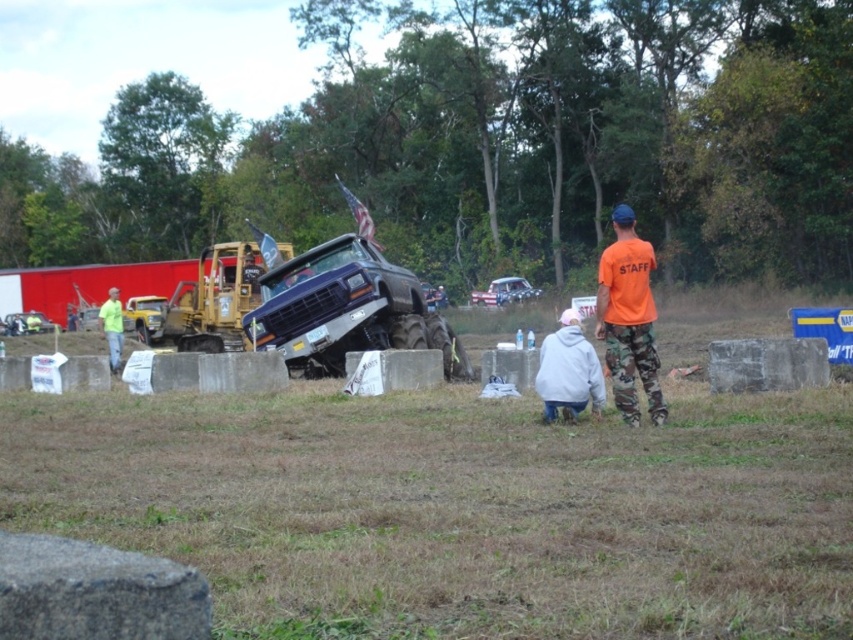
Question: Which object appears closest to the camera in this image?

Choices:
 (A) metallic silver car at center
 (B) neon yellow jacket at left

Answer: (B)

Question: Does orange t-shirt at right appear over gray fleece jacket at center?

Choices:
 (A) yes
 (B) no

Answer: (A)

Question: Estimate the real-world distances between objects in this image. Which object is closer to the orange t-shirt at right?

Choices:
 (A) metallic purple truck at center
 (B) gray fleece jacket at center

Answer: (B)

Question: Estimate the real-world distances between objects in this image. Which object is closer to the brushed metal car at left?

Choices:
 (A) metallic purple truck at center
 (B) neon yellow jacket at left
 (C) gray fleece jacket at center
 (D) orange t-shirt at right

Answer: (B)

Question: Does metallic purple truck at center have a larger size compared to neon yellow jacket at left?

Choices:
 (A) yes
 (B) no

Answer: (A)

Question: Considering the relative positions of gray fleece jacket at center and brushed metal car at left in the image provided, where is gray fleece jacket at center located with respect to brushed metal car at left?

Choices:
 (A) right
 (B) left

Answer: (A)